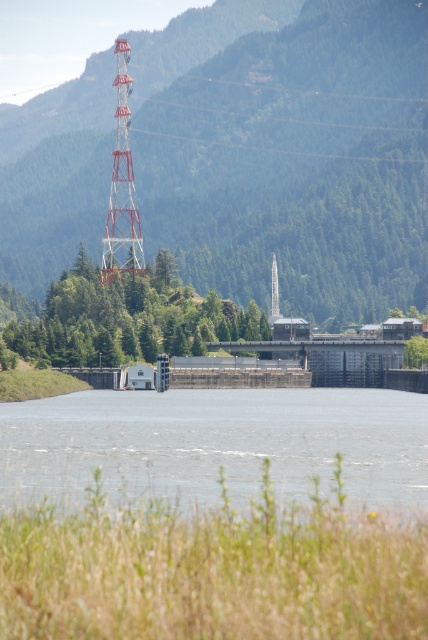
Question: Among these points, which one is farthest from the camera?

Choices:
 (A) (38, 472)
 (B) (273, 316)
 (C) (122, 42)

Answer: (C)

Question: Can you confirm if gray concrete river at center is thinner than metallic red tower at upper left?

Choices:
 (A) no
 (B) yes

Answer: (A)

Question: Can you confirm if gray concrete river at center is positioned to the right of white metal tower at center?

Choices:
 (A) no
 (B) yes

Answer: (A)

Question: Which point is closer to the camera?

Choices:
 (A) gray concrete river at center
 (B) metallic red tower at upper left
 (C) white metal tower at center

Answer: (A)

Question: Which is nearer to the white metal tower at center?

Choices:
 (A) metallic red tower at upper left
 (B) gray concrete river at center

Answer: (A)

Question: Considering the relative positions of metallic red tower at upper left and white metal tower at center in the image provided, where is metallic red tower at upper left located with respect to white metal tower at center?

Choices:
 (A) above
 (B) below

Answer: (A)